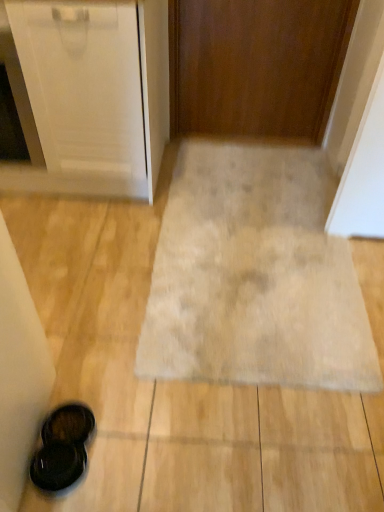
Question: Does point (340, 378) appear closer or farther from the camera than point (228, 93)?

Choices:
 (A) closer
 (B) farther

Answer: (A)

Question: Considering their positions, is beige carpet at center located in front of or behind wooden door at center?

Choices:
 (A) front
 (B) behind

Answer: (A)

Question: Which of these objects is positioned farthest from the beige carpet at center?

Choices:
 (A) black matte sandals at lower left
 (B) wooden door at center

Answer: (B)

Question: Estimate the real-world distances between objects in this image. Which object is farther from the wooden door at center?

Choices:
 (A) beige carpet at center
 (B) black matte sandals at lower left

Answer: (B)